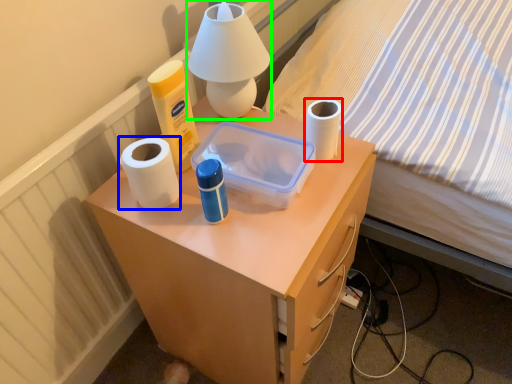
Question: Which is farther away from toilet paper (highlighted by a red box)? paper towel (highlighted by a blue box) or table lamp (highlighted by a green box)?

Choices:
 (A) paper towel
 (B) table lamp

Answer: (A)